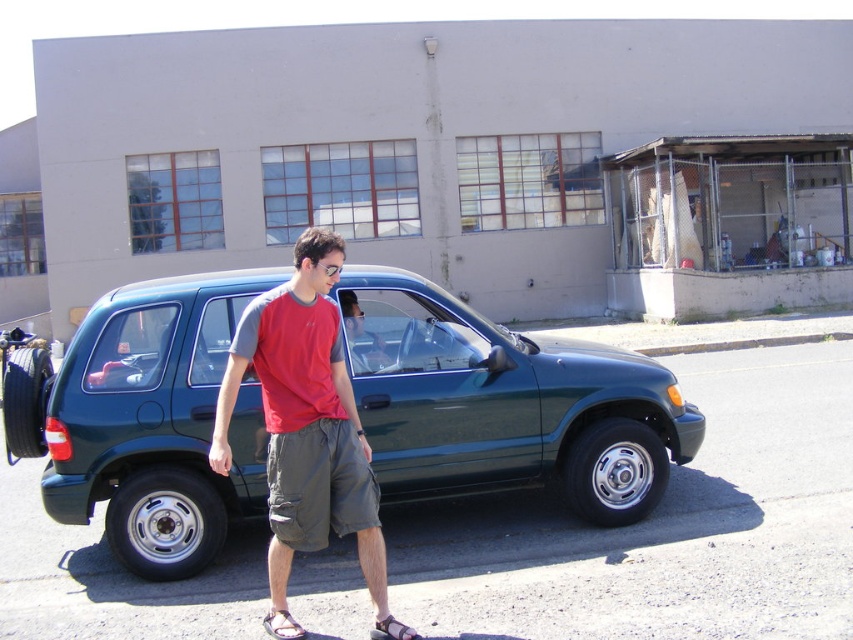
Question: Which of the following is the farthest from the observer?

Choices:
 (A) (310, 369)
 (B) (285, 627)
 (C) (645, 497)

Answer: (C)

Question: Can you confirm if matte red t-shirt at center is positioned below brown leather sandal at lower center?

Choices:
 (A) yes
 (B) no

Answer: (B)

Question: Which of the following is the farthest from the observer?

Choices:
 (A) brown leather sandal at lower center
 (B) purple fabric sandal at lower center

Answer: (B)

Question: Does matte red t-shirt at center have a larger size compared to purple fabric sandal at lower center?

Choices:
 (A) yes
 (B) no

Answer: (A)

Question: Is green metallic minivan at center thinner than matte red t-shirt at center?

Choices:
 (A) yes
 (B) no

Answer: (B)

Question: Among these objects, which one is nearest to the camera?

Choices:
 (A) green metallic minivan at center
 (B) brown leather sandal at lower center
 (C) purple fabric sandal at lower center
 (D) matte red t-shirt at center

Answer: (B)